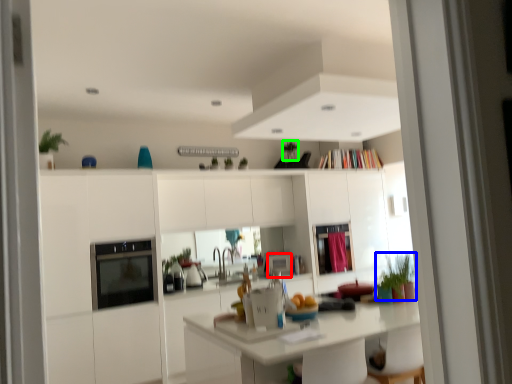
Question: Which is nearer to the appliance (highlighted by a red box)? plant (highlighted by a blue box) or plant (highlighted by a green box).

Choices:
 (A) plant
 (B) plant

Answer: (B)